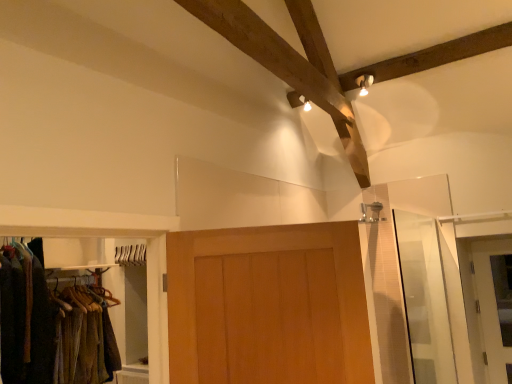
What do you see at coordinates (490, 307) in the screenshot? I see `white glossy door at right, the second door viewed from the front` at bounding box center [490, 307].

The width and height of the screenshot is (512, 384). Find the location of `transparent glass screen door at right`. transparent glass screen door at right is located at coordinates (424, 298).

Locate an element on the screen. white glossy door at right, which is counted as the 1th door, starting from the back is located at coordinates (490, 307).

Does wooden door at center, placed as the first door when sorted from left to right, have a greater width compared to white glossy door at right, the second door viewed from the front?

Correct, the width of wooden door at center, placed as the first door when sorted from left to right, exceeds that of white glossy door at right, the second door viewed from the front.

From the image's perspective, is wooden door at center, the 2th door in the back-to-front sequence, above or below white glossy door at right, which is counted as the 1th door, starting from the back?

Clearly, from the image's perspective, wooden door at center, the 2th door in the back-to-front sequence, is above white glossy door at right, which is counted as the 1th door, starting from the back.

Based on the photo, in terms of size, does wooden door at center, the 2th door positioned from the right, appear bigger or smaller than white glossy door at right, which is counted as the 1th door, starting from the back?

wooden door at center, the 2th door positioned from the right, is bigger than white glossy door at right, which is counted as the 1th door, starting from the back.

Is wooden door at center, the first door in the front-to-back sequence, facing away from white glossy door at right, the second door viewed from the front?

wooden door at center, the first door in the front-to-back sequence, is not turned away from white glossy door at right, the second door viewed from the front.

Could you measure the distance between transparent glass screen door at right and white glossy door at right, placed as the first door when sorted from right to left?

The distance of transparent glass screen door at right from white glossy door at right, placed as the first door when sorted from right to left, is 57.50 centimeters.

Does point (407, 262) lie behind point (503, 250)?

No, (407, 262) is closer to viewer.

Considering the sizes of transparent glass screen door at right and white glossy door at right, placed as the first door when sorted from right to left, in the image, is transparent glass screen door at right wider or thinner than white glossy door at right, placed as the first door when sorted from right to left,?

In the image, transparent glass screen door at right appears to be wider than white glossy door at right, placed as the first door when sorted from right to left.

At what (x,y) coordinates should I click in order to perform the action: click on door that appears below the transparent glass screen door at right (from a real-world perspective). Please return your answer as a coordinate pair (x, y). This screenshot has height=384, width=512. Looking at the image, I should click on (490, 307).

Considering the points (484, 248) and (336, 374), which point is in front, point (484, 248) or point (336, 374)?

The point (336, 374) is more forward.

Based on the photo, can you confirm if white glossy door at right, the second door viewed from the front, is smaller than wooden door at center, the 2th door positioned from the right?

Yes, white glossy door at right, the second door viewed from the front, is smaller than wooden door at center, the 2th door positioned from the right.

Is white glossy door at right, which is counted as the 1th door, starting from the back, with wooden door at center, the 2th door in the back-to-front sequence?

They are not placed beside each other.

Is white glossy door at right, positioned as the 2th door in left-to-right order, taller or shorter than wooden door at center, placed as the first door when sorted from left to right?

Clearly, white glossy door at right, positioned as the 2th door in left-to-right order, is taller compared to wooden door at center, placed as the first door when sorted from left to right.

Visually, is wooden door at center, the first door in the front-to-back sequence, positioned to the left or to the right of transparent glass screen door at right?

wooden door at center, the first door in the front-to-back sequence, is positioned on transparent glass screen door at right's left side.

Are wooden door at center, placed as the first door when sorted from left to right, and transparent glass screen door at right located far from each other?

Yes, wooden door at center, placed as the first door when sorted from left to right, and transparent glass screen door at right are located far from each other.

Is wooden door at center, the 2th door positioned from the right, bigger or smaller than transparent glass screen door at right?

Clearly, wooden door at center, the 2th door positioned from the right, is larger in size than transparent glass screen door at right.

Looking at this image, is white glossy door at right, which is counted as the 1th door, starting from the back, inside or outside of transparent glass screen door at right?

white glossy door at right, which is counted as the 1th door, starting from the back, is not inside transparent glass screen door at right, it's outside.

What's the angular difference between white glossy door at right, which is counted as the 1th door, starting from the back, and transparent glass screen door at right's facing directions?

89.4 degrees separate the facing orientations of white glossy door at right, which is counted as the 1th door, starting from the back, and transparent glass screen door at right.

The height and width of the screenshot is (384, 512). What are the coordinates of `screen door located on the left of white glossy door at right, positioned as the 2th door in left-to-right order` in the screenshot? It's located at (424, 298).

From the image's perspective, which one is positioned higher, white glossy door at right, the second door viewed from the front, or transparent glass screen door at right?

transparent glass screen door at right, from the image's perspective.

Which is nearer, (443, 360) or (201, 274)?

Clearly, point (443, 360) is more distant from the camera than point (201, 274).

Is transparent glass screen door at right touching wooden door at center, placed as the first door when sorted from left to right?

There is a gap between transparent glass screen door at right and wooden door at center, placed as the first door when sorted from left to right.

Considering the relative sizes of transparent glass screen door at right and wooden door at center, the 2th door in the back-to-front sequence, in the image provided, is transparent glass screen door at right taller than wooden door at center, the 2th door in the back-to-front sequence,?

Yes, transparent glass screen door at right is taller than wooden door at center, the 2th door in the back-to-front sequence.

Locate an element on the screen. Image resolution: width=512 pixels, height=384 pixels. door below the wooden door at center, placed as the first door when sorted from left to right (from the image's perspective) is located at coordinates (490, 307).

In order to click on screen door above the white glossy door at right, the second door viewed from the front (from the image's perspective) in this screenshot , I will do `click(424, 298)`.

Estimate the real-world distances between objects in this image. Which object is further from transparent glass screen door at right, wooden door at center, the 2th door in the back-to-front sequence, or white glossy door at right, positioned as the 2th door in left-to-right order?

wooden door at center, the 2th door in the back-to-front sequence, lies further to transparent glass screen door at right than the other object.

From the image, which object appears to be nearer to white glossy door at right, placed as the first door when sorted from right to left, transparent glass screen door at right or wooden door at center, the first door in the front-to-back sequence?

Among the two, transparent glass screen door at right is located nearer to white glossy door at right, placed as the first door when sorted from right to left.

From the image, which object appears to be farther from wooden door at center, the 2th door in the back-to-front sequence, transparent glass screen door at right or white glossy door at right, the second door viewed from the front?

white glossy door at right, the second door viewed from the front, is further to wooden door at center, the 2th door in the back-to-front sequence.

Looking at the image, which one is located further to white glossy door at right, positioned as the 2th door in left-to-right order, wooden door at center, the 2th door positioned from the right, or transparent glass screen door at right?

The object further to white glossy door at right, positioned as the 2th door in left-to-right order, is wooden door at center, the 2th door positioned from the right.

From the image, which object appears to be nearer to wooden door at center, the 2th door positioned from the right, white glossy door at right, positioned as the 2th door in left-to-right order, or transparent glass screen door at right?

transparent glass screen door at right lies closer to wooden door at center, the 2th door positioned from the right, than the other object.

Looking at the image, which one is located closer to transparent glass screen door at right, white glossy door at right, the second door viewed from the front, or wooden door at center, the 2th door in the back-to-front sequence?

Among the two, white glossy door at right, the second door viewed from the front, is located nearer to transparent glass screen door at right.

Identify the location of screen door located between wooden door at center, the first door in the front-to-back sequence, and white glossy door at right, the second door viewed from the front, in the left-right direction. The image size is (512, 384). (424, 298).